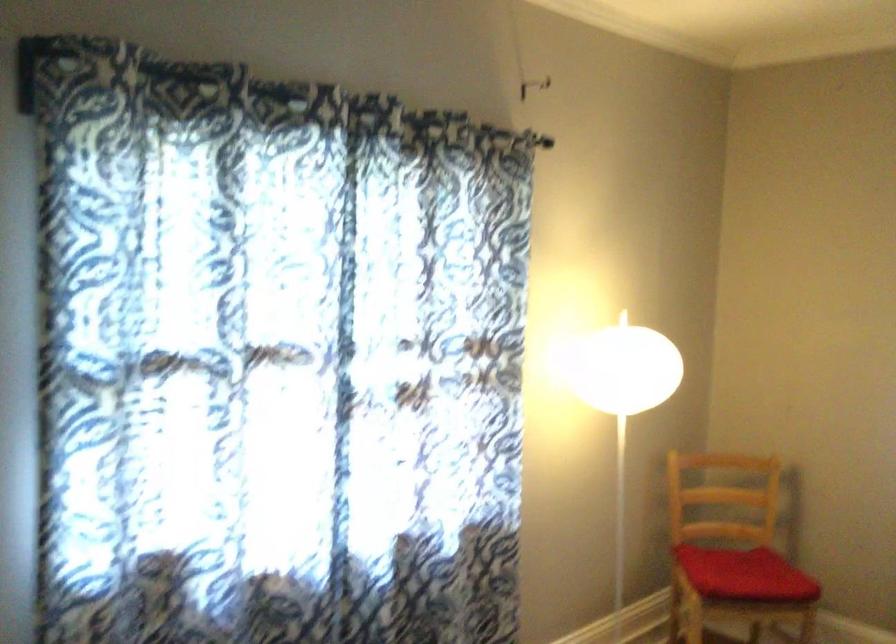
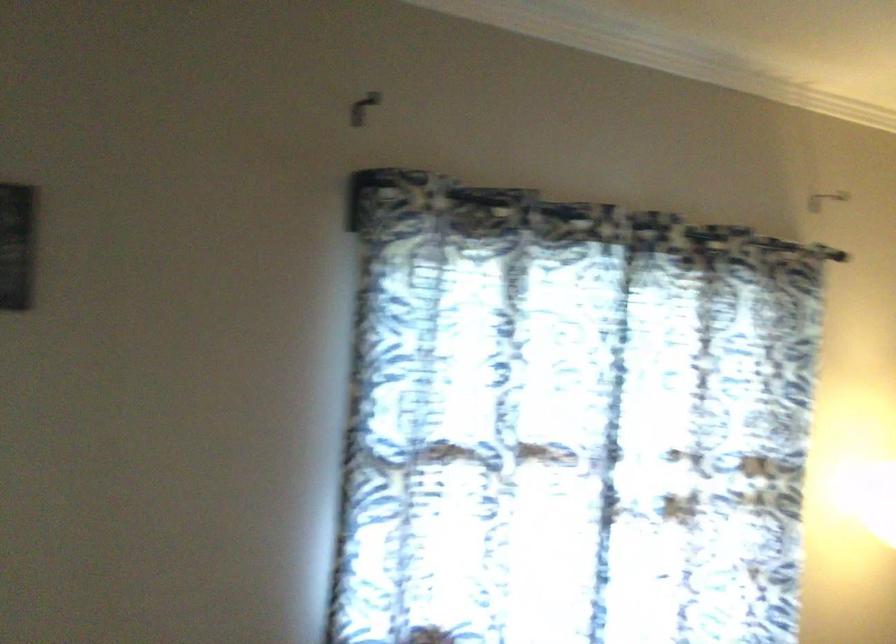
Locate, in the second image, the point that corresponds to the point at 528,90 in the first image.

(824, 199)